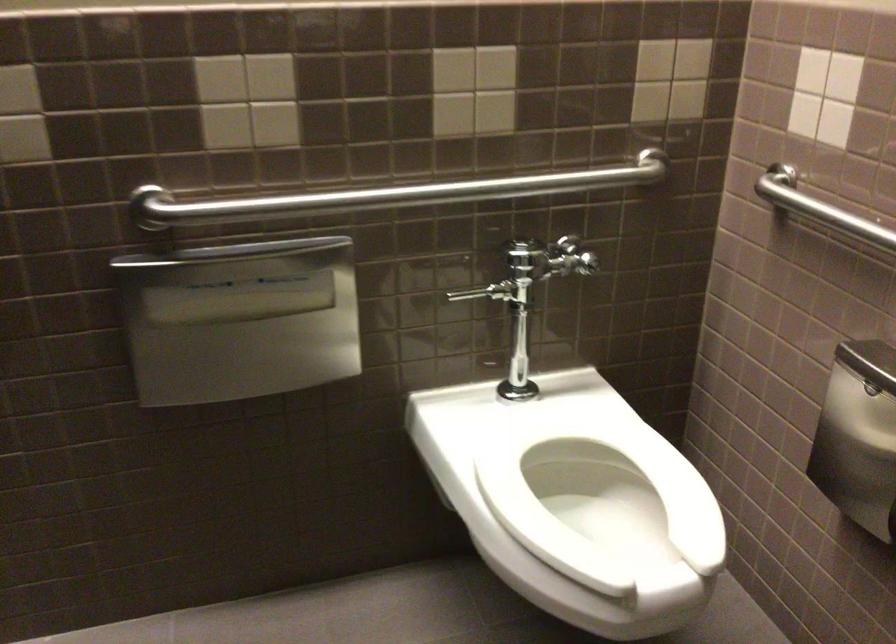
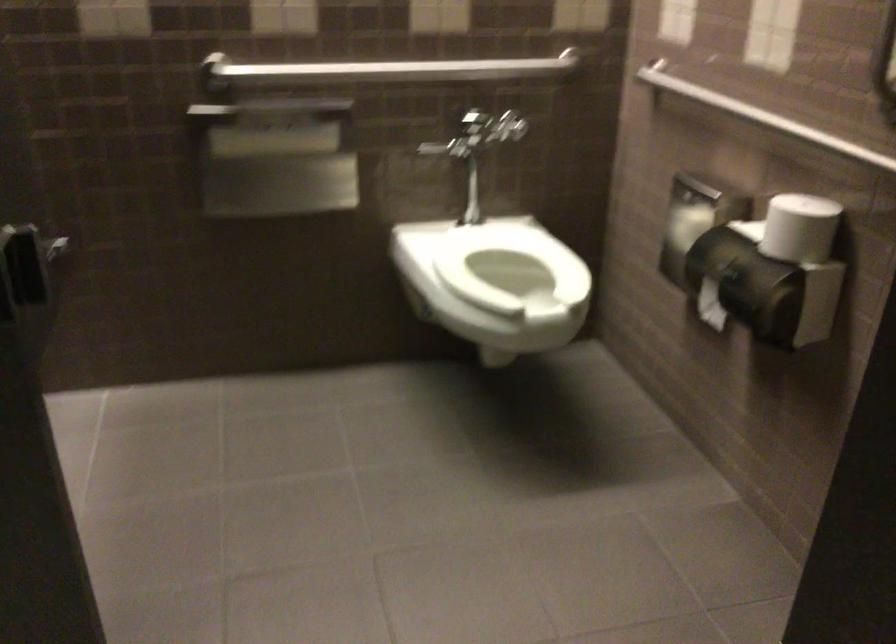
Find the pixel in the second image that matches [240,303] in the first image.

(273, 143)